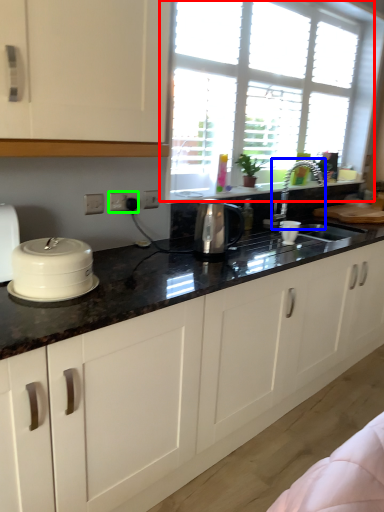
Question: Estimate the real-world distances between objects in this image. Which object is closer to window (highlighted by a red box), faucet (highlighted by a blue box) or electric outlet (highlighted by a green box)?

Choices:
 (A) faucet
 (B) electric outlet

Answer: (A)